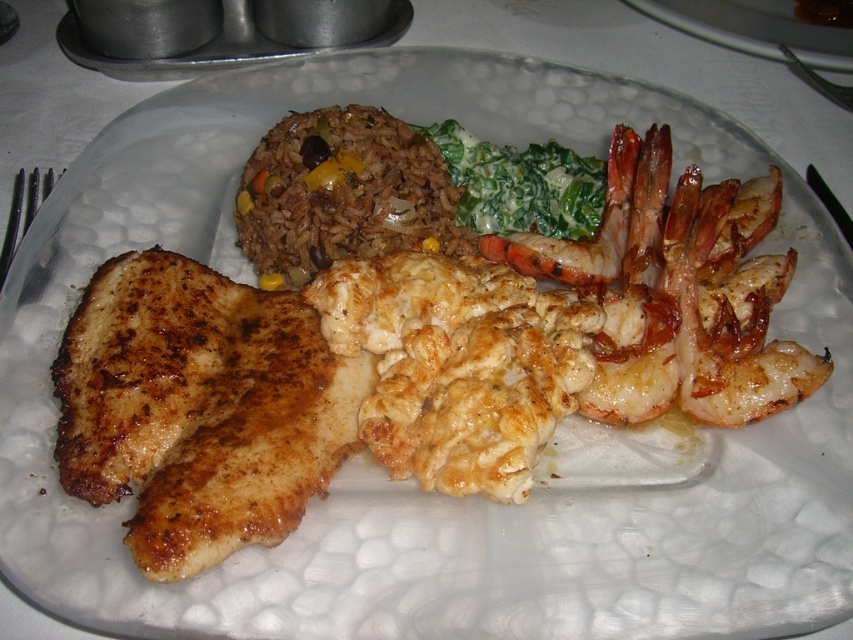
You are a food critic sitting at a table 1.5 meters away from the plate. You want to take a bite of the brown rice at center. Can you reach it without moving your chair?

The brown rice at center is 1.37 meters away from the camera, so if you are sitting 1.5 meters away from the plate, you can comfortably reach it without moving your chair.

From the picture: You are a food critic evaluating this meal. You need to describe the portion sizes of the brown rice at center and the green creamy spinach at upper center. Which one has a larger portion?

The brown rice at center has a larger portion than the green creamy spinach at upper center.

You are a food critic evaluating the presentation of this meal. You notice the brown rice at center and the green creamy spinach at upper center. Which component occupies a larger area on the plate?

The brown rice at center occupies a larger area on the plate since its width is greater than that of the green creamy spinach at upper center.